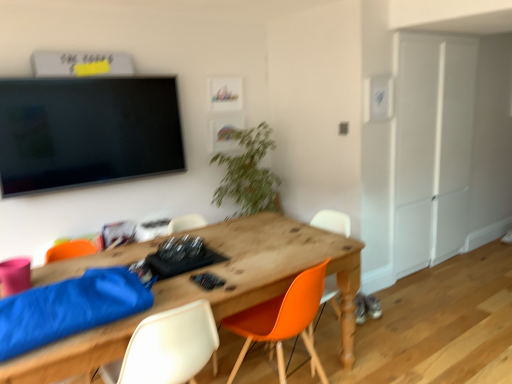
Question: Considering the relative sizes of green leafy plant at center and white plastic chair at lower center, which ranks as the 3th chair in right-to-left order, in the image provided, is green leafy plant at center shorter than white plastic chair at lower center, which ranks as the 3th chair in right-to-left order,?

Choices:
 (A) no
 (B) yes

Answer: (A)

Question: Considering the relative sizes of green leafy plant at center and white plastic chair at lower center, which ranks as the 3th chair in right-to-left order, in the image provided, is green leafy plant at center smaller than white plastic chair at lower center, which ranks as the 3th chair in right-to-left order,?

Choices:
 (A) yes
 (B) no

Answer: (B)

Question: Is green leafy plant at center further to camera compared to white plastic chair at lower center, which ranks as the 3th chair in right-to-left order?

Choices:
 (A) no
 (B) yes

Answer: (B)

Question: Can you confirm if green leafy plant at center is taller than white plastic chair at lower center, which ranks as the 3th chair in right-to-left order?

Choices:
 (A) yes
 (B) no

Answer: (A)

Question: From a real-world perspective, is green leafy plant at center on top of white plastic chair at lower center, which is the 1th chair from left to right?

Choices:
 (A) no
 (B) yes

Answer: (B)

Question: Considering their positions, is wooden desk at center located in front of or behind white matte armoire at right?

Choices:
 (A) behind
 (B) front

Answer: (B)

Question: In terms of width, does wooden desk at center look wider or thinner when compared to white matte armoire at right?

Choices:
 (A) wide
 (B) thin

Answer: (A)

Question: From their relative heights in the image, would you say wooden desk at center is taller or shorter than white matte armoire at right?

Choices:
 (A) short
 (B) tall

Answer: (A)

Question: Is wooden desk at center spatially inside white matte armoire at right, or outside of it?

Choices:
 (A) outside
 (B) inside

Answer: (A)

Question: In terms of width, does orange plastic chair at center, which is the second chair in right-to-left order, look wider or thinner when compared to white matte armoire at right?

Choices:
 (A) thin
 (B) wide

Answer: (B)

Question: Is orange plastic chair at center, which is the second chair in right-to-left order, bigger or smaller than white matte armoire at right?

Choices:
 (A) big
 (B) small

Answer: (B)

Question: Do you think orange plastic chair at center, which is the second chair in right-to-left order, is within white matte armoire at right, or outside of it?

Choices:
 (A) outside
 (B) inside

Answer: (A)

Question: Considering the positions of point pyautogui.click(x=237, y=329) and point pyautogui.click(x=452, y=120), is point pyautogui.click(x=237, y=329) closer or farther from the camera than point pyautogui.click(x=452, y=120)?

Choices:
 (A) farther
 (B) closer

Answer: (B)

Question: From a real-world perspective, is orange matte chair at center, placed as the 1th chair when sorted from right to left, above or below wooden desk at center?

Choices:
 (A) below
 (B) above

Answer: (B)

Question: Based on their sizes in the image, would you say orange matte chair at center, the third chair from the left, is bigger or smaller than wooden desk at center?

Choices:
 (A) big
 (B) small

Answer: (B)